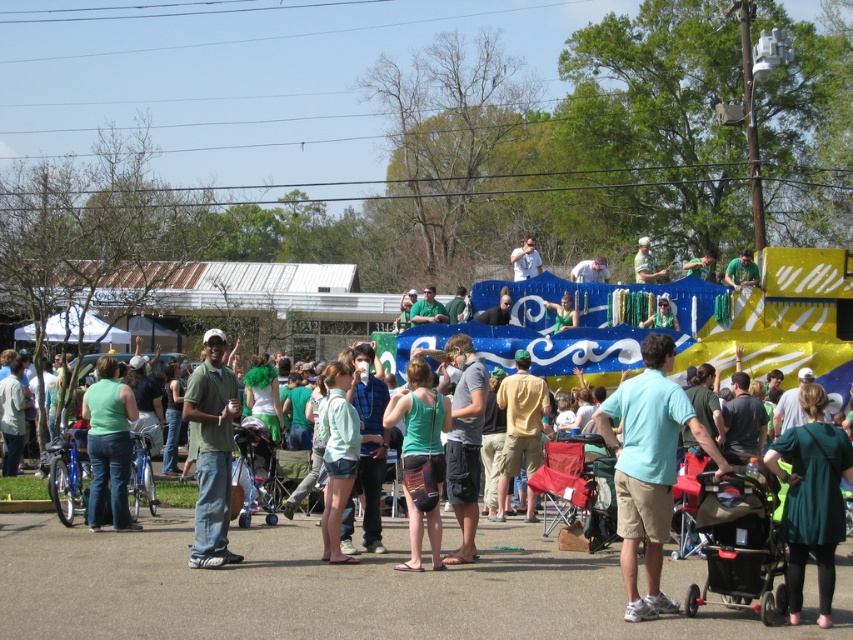
You are a photographer at the event and want to capture both the matte green tank top at center and the matte green shirt at upper center in a single photo. Which one should you focus on first to ensure both are in frame?

You should focus on the matte green tank top at center first because it is in front of the matte green shirt at upper center, so adjusting the camera to include the foreground object ensures the background one is also captured.

You are taking a photo of the lively outdoor scene with your camera. You notice two points marked as point 1 at coordinates point (102, 484) and point 2 at coordinates point (653, 282). Which point will appear larger in your photo?

Point 1 at coordinates point (102, 484) will appear larger in the photo because it is closer to the camera than point 2 at coordinates point (653, 282).